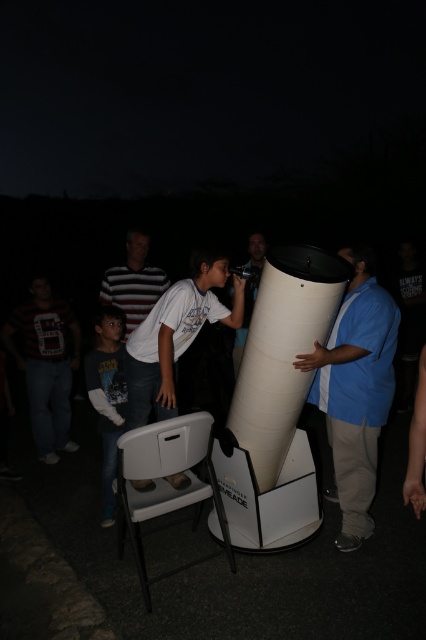
Which is above, white matte shirt at center or striped cotton shirt at center?

striped cotton shirt at center is higher up.

This screenshot has height=640, width=426. Identify the location of white matte shirt at center. (175, 333).

At what (x,y) coordinates should I click in order to perform the action: click on white matte shirt at center. Please return your answer as a coordinate pair (x, y). The image size is (426, 640). Looking at the image, I should click on (175, 333).

Measure the distance from blue fabric shirt at center to striped cotton shirt at center.

6.14 feet

Is blue fabric shirt at center positioned before striped cotton shirt at center?

Yes, blue fabric shirt at center is in front of striped cotton shirt at center.

Is point (347, 342) closer to camera compared to point (149, 275)?

Yes, point (347, 342) is in front of point (149, 275).

This screenshot has width=426, height=640. I want to click on blue fabric shirt at center, so click(356, 390).

Can you confirm if blue fabric shirt at center is shorter than white matte shirt at center?

Incorrect, blue fabric shirt at center's height does not fall short of white matte shirt at center's.

Between point (342, 419) and point (143, 384), which one is positioned behind?

The point (143, 384) is more distant.

The width and height of the screenshot is (426, 640). Find the location of `blue fabric shirt at center`. blue fabric shirt at center is located at coordinates (356, 390).

Identify the location of blue fabric shirt at center. The width and height of the screenshot is (426, 640). (356, 390).